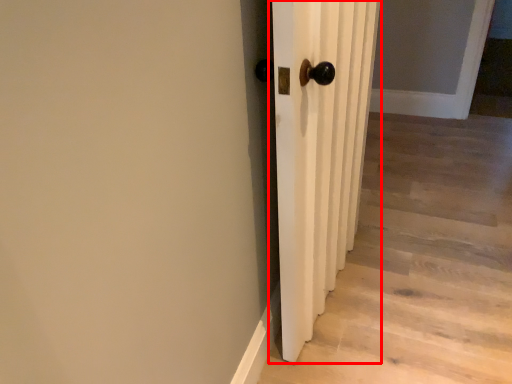
Question: Where is door (annotated by the red box) located in relation to stairwell in the image?

Choices:
 (A) right
 (B) left

Answer: (B)